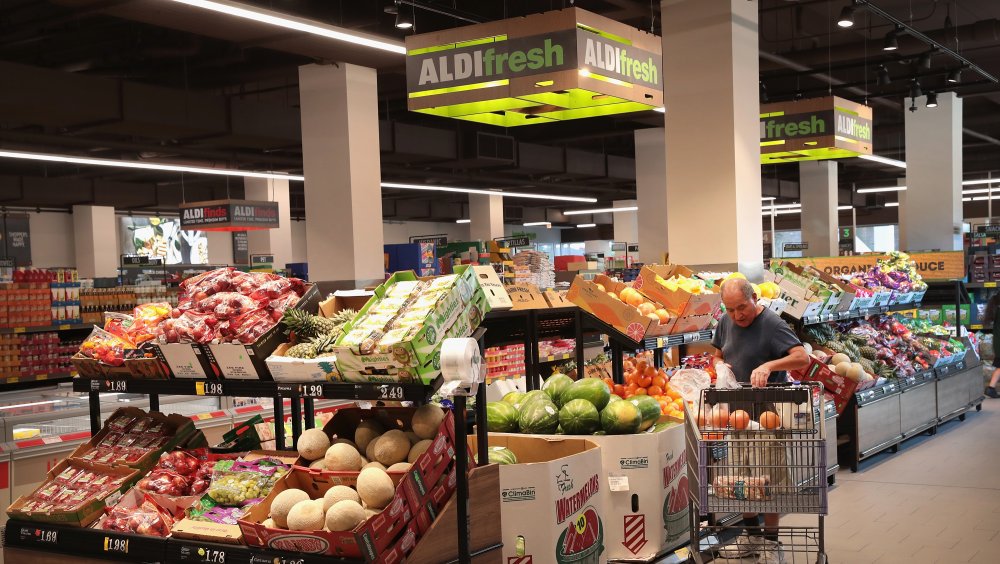
Identify the location of column. (340, 144), (644, 153), (724, 160), (919, 171), (822, 202).